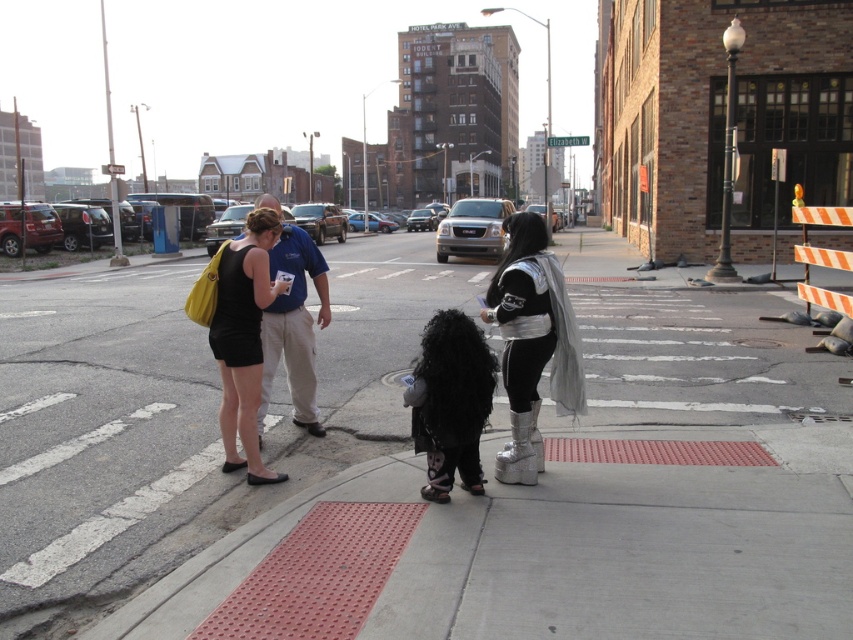
You are a delivery robot on the smooth concrete sidewalk at center. You need to deliver a package to the silver metallic platform boots at center. Can you move directly towards them without obstacles?

The smooth concrete sidewalk at center is closer to the viewer than the silver metallic platform boots at center, so the robot can move directly towards them without obstacles as there is no obstruction between them.

You are a delivery robot that needs to place a package on the smooth concrete sidewalk at center. The package is 2 meters tall. Can the package be placed there without exceeding the height of the black matte dress at center?

The smooth concrete sidewalk at center is taller than the black matte dress at center. Since the package is 2 meters tall, it would exceed the height of the black matte dress at center, so placing the package there would not be possible without exceeding the dress height.